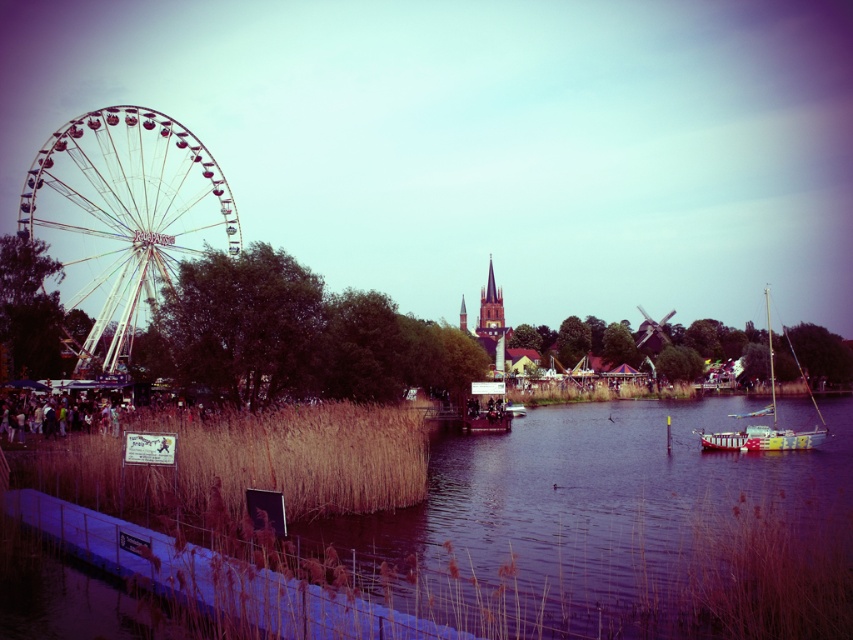
You are standing at the edge of the water and want to walk from the brown reeds at lower center to the painted wood sailboat at right. Which direction should you head to reach the sailboat?

Since the brown reeds at lower center are closer to you than the painted wood sailboat at right, you should head towards the right side of the water to reach the sailboat.

You are standing at the center of the image and want to locate the brown reeds at lower center. According to the coordinates provided, in which direction should you look to find them?

The brown reeds at lower center are located at coordinates point [622,528], so you should look to the lower right direction to find them.

You are planning to set up a picnic blanket in the area between the brown reeds at lower center and the white metallic ferris wheel at left. Considering their sizes, which object would require more space to accommodate when placing your blanket?

The brown reeds at lower center would require more space because their width is larger than the white metallic ferris wheel at left.